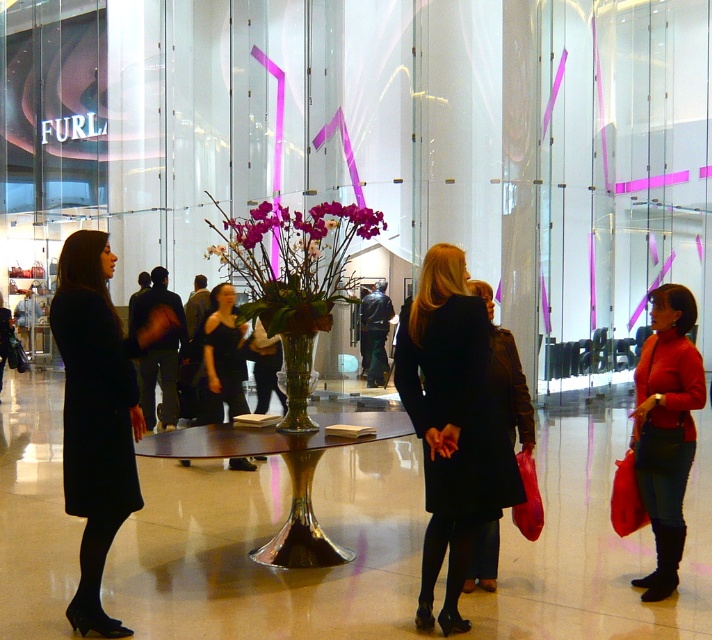
Who is taller, metallic gold table at center or black dress at center?

With more height is black dress at center.

Is metallic gold table at center thinner than black dress at center?

No.

Is point (320, 451) positioned in front of point (214, 294)?

Yes, point (320, 451) is in front of point (214, 294).

I want to click on metallic gold table at center, so click(287, 470).

Is matte black coat at left above black dress at center?

No.

Measure the distance between matte black coat at left and camera.

matte black coat at left is 12.40 feet away from camera.

The height and width of the screenshot is (640, 712). I want to click on matte black coat at left, so click(x=95, y=413).

How distant is black matte coat at center from matte black coat at left?

4.79 feet

Where is `black matte coat at center`? The width and height of the screenshot is (712, 640). black matte coat at center is located at coordinates (451, 424).

Image resolution: width=712 pixels, height=640 pixels. In order to click on black matte coat at center in this screenshot , I will do `click(451, 424)`.

You are a GUI agent. You are given a task and a screenshot of the screen. Output one action in this format:
    pyautogui.click(x=<x>, y=<y>)
    Task: Click on the black matte coat at center
    Image resolution: width=712 pixels, height=640 pixels.
    Given the screenshot: What is the action you would take?
    (x=451, y=424)